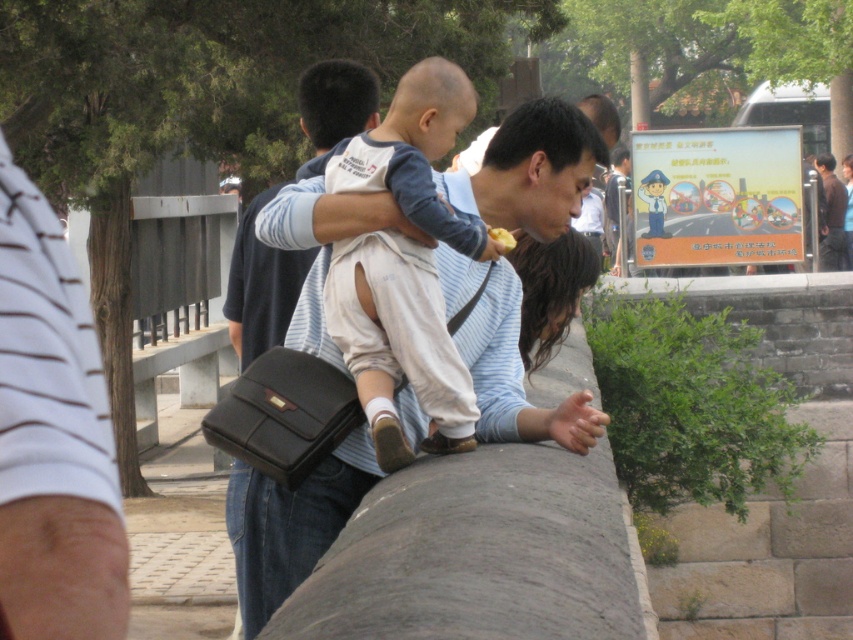
Does white striped shirt at left have a greater height compared to dark brown hair at center?

Yes, white striped shirt at left is taller than dark brown hair at center.

Which is behind, point (25, 532) or point (579, 273)?

Point (579, 273)

At what (x,y) coordinates should I click in order to perform the action: click on white striped shirt at left. Please return your answer as a coordinate pair (x, y). Looking at the image, I should click on (51, 435).

Measure the distance between white striped shirt at left and camera.

white striped shirt at left and camera are 1.53 meters apart.

Who is more forward, (x=24, y=177) or (x=819, y=259)?

Point (x=24, y=177) is in front.

Between point (6, 499) and point (822, 157), which one is positioned behind?

Point (822, 157)

Identify the location of white striped shirt at left. (51, 435).

Between point (335, 305) and point (527, 243), which one is positioned behind?

Positioned behind is point (527, 243).

You are a GUI agent. You are given a task and a screenshot of the screen. Output one action in this format:
    pyautogui.click(x=<x>, y=<y>)
    Task: Click on the light beige cotton pants at center
    Image resolution: width=853 pixels, height=640 pixels.
    Given the screenshot: What is the action you would take?
    pyautogui.click(x=397, y=342)

Identify the location of light beige cotton pants at center. The image size is (853, 640). (397, 342).